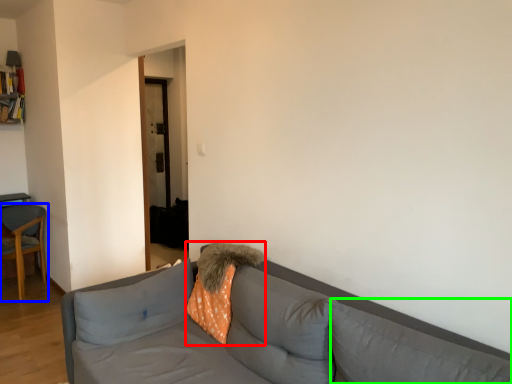
Question: Which object is the farthest from throw pillow (highlighted by a red box)? Choose among these: chair (highlighted by a blue box) or pillow (highlighted by a green box).

Choices:
 (A) chair
 (B) pillow

Answer: (A)